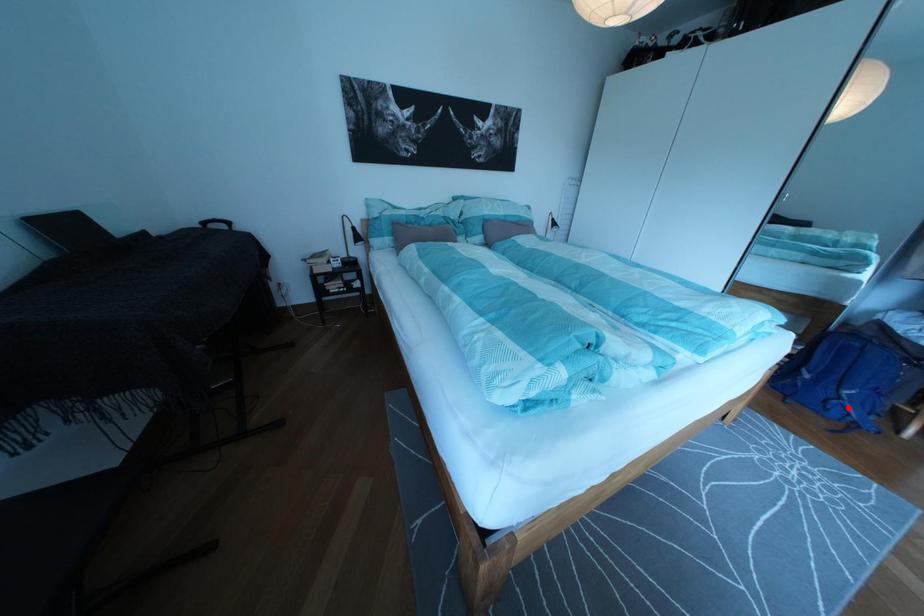
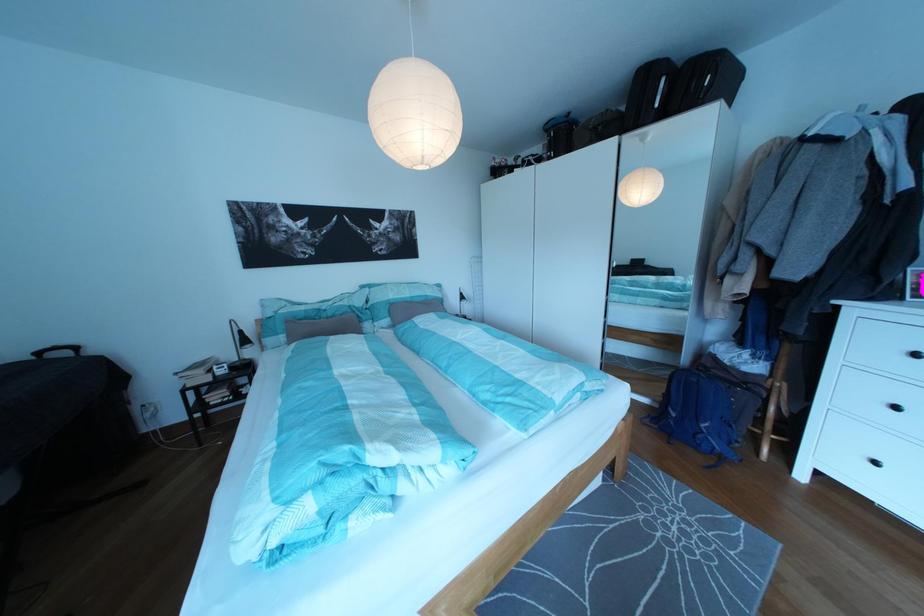
Where in the second image is the point corresponding to the highlighted location from the first image?

(713, 442)